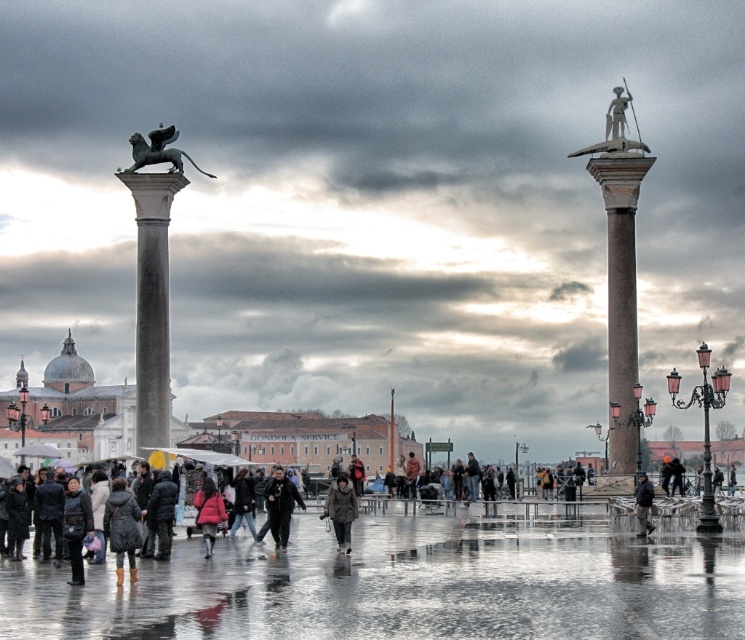
Question: Which point appears closest to the camera in this image?

Choices:
 (A) (272, 516)
 (B) (589, 147)
 (C) (649, 509)
 (D) (197, 502)

Answer: (C)

Question: In this image, where is dark brown leather jacket at center located relative to dark gray jacket at lower right?

Choices:
 (A) above
 (B) below

Answer: (B)

Question: Which of these objects is positioned closest to the dark brown leather jacket at center?

Choices:
 (A) smooth stone column at left
 (B) polished stone statue at right
 (C) brown fuzzy coat at center

Answer: (C)

Question: Considering the real-world distances, which object is closest to the white stone statue at upper right?

Choices:
 (A) black polished lion at upper left
 (B) polished stone statue at right
 (C) smooth stone column at left

Answer: (B)

Question: Is polished stone statue at right further to camera compared to dark gray leather jacket at lower left?

Choices:
 (A) no
 (B) yes

Answer: (B)

Question: Can you confirm if smooth stone column at left is positioned to the left of brown fuzzy coat at center?

Choices:
 (A) no
 (B) yes

Answer: (B)